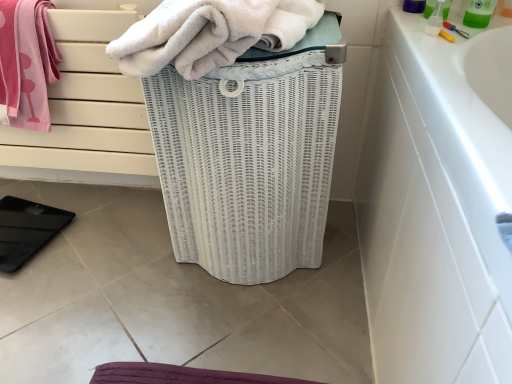
What is the approximate width of pink cotton towel at upper left, which is the 1th towel in left-to-right order?

It is 6.63 inches.

What do you see at coordinates (210, 34) in the screenshot? I see `white fluffy towel at center, which appears as the 1th towel when viewed from the right` at bounding box center [210, 34].

What do you see at coordinates (250, 157) in the screenshot?
I see `white wicker basket at center` at bounding box center [250, 157].

This screenshot has height=384, width=512. I want to click on white wicker basket at center, so click(x=250, y=157).

At what (x,y) coordinates should I click in order to perform the action: click on pink cotton towel at upper left, which is the 2th towel in right-to-left order. Please return your answer as a coordinate pair (x, y). This screenshot has height=384, width=512. Looking at the image, I should click on (26, 64).

From a real-world perspective, which is physically above, white fluffy towel at center, which appears as the 1th towel when viewed from the right, or white wicker basket at center?

From a 3D spatial view, white fluffy towel at center, which appears as the 1th towel when viewed from the right, is above.

Between white fluffy towel at center, which appears as the 1th towel when viewed from the right, and white wicker basket at center, which one is positioned in front?

Positioned in front is white fluffy towel at center, which appears as the 1th towel when viewed from the right.

Is white fluffy towel at center, arranged as the second towel when viewed from the left, taller or shorter than white wicker basket at center?

Clearly, white fluffy towel at center, arranged as the second towel when viewed from the left, is shorter compared to white wicker basket at center.

Image resolution: width=512 pixels, height=384 pixels. In order to click on the 2nd towel directly above the white wicker basket at center (from a real-world perspective) in this screenshot , I will do `click(210, 34)`.

From the image's perspective, is white wicker basket at center above or below pink cotton towel at upper left, which is the 2th towel in right-to-left order?

white wicker basket at center is situated lower than pink cotton towel at upper left, which is the 2th towel in right-to-left order, in the image.

Considering the sizes of objects white wicker basket at center and pink cotton towel at upper left, which is the 1th towel in left-to-right order, in the image provided, who is bigger, white wicker basket at center or pink cotton towel at upper left, which is the 1th towel in left-to-right order,?

Bigger between the two is white wicker basket at center.

Can you tell me how much white wicker basket at center and pink cotton towel at upper left, which is the 1th towel in left-to-right order, differ in facing direction?

white wicker basket at center and pink cotton towel at upper left, which is the 1th towel in left-to-right order, are facing 0.486 degrees away from each other.

Is green plastic bottle at upper right oriented towards white fluffy towel at center, which appears as the 1th towel when viewed from the right?

No, green plastic bottle at upper right is not facing towards white fluffy towel at center, which appears as the 1th towel when viewed from the right.

From the image's perspective, which is above, green plastic bottle at upper right or white fluffy towel at center, which appears as the 1th towel when viewed from the right?

From the image's view, green plastic bottle at upper right is above.

Is green plastic bottle at upper right not close to white fluffy towel at center, which appears as the 1th towel when viewed from the right?

No.

From the image's perspective, which one is positioned lower, white wicker basket at center or green plastic bottle at upper right?

white wicker basket at center, from the image's perspective.

Find the location of `cleaning product on the right side of white wicker basket at center`. cleaning product on the right side of white wicker basket at center is located at coordinates (479, 13).

How many degrees apart are the facing directions of white wicker basket at center and green plastic bottle at upper right?

The facing directions of white wicker basket at center and green plastic bottle at upper right are 26.3 degrees apart.

In the scene shown: Is white wicker basket at center positioned with its back to green plastic bottle at upper right?

No, white wicker basket at center is not facing away from green plastic bottle at upper right.

Looking at their sizes, would you say pink cotton towel at upper left, which is the 1th towel in left-to-right order, is wider or thinner than white wicker basket at center?

In the image, pink cotton towel at upper left, which is the 1th towel in left-to-right order, appears to be more narrow than white wicker basket at center.

From a real-world perspective, is pink cotton towel at upper left, which is the 1th towel in left-to-right order, physically located above or below white wicker basket at center?

From a real-world perspective, pink cotton towel at upper left, which is the 1th towel in left-to-right order, is physically above white wicker basket at center.

Which of these two, pink cotton towel at upper left, which is the 1th towel in left-to-right order, or white wicker basket at center, is bigger?

Bigger between the two is white wicker basket at center.

Can you confirm if pink cotton towel at upper left, which is the 2th towel in right-to-left order, is shorter than white wicker basket at center?

Indeed, pink cotton towel at upper left, which is the 2th towel in right-to-left order, has a lesser height compared to white wicker basket at center.

Considering the relative positions of green plastic bottle at upper right and pink cotton towel at upper left, which is the 2th towel in right-to-left order, in the image provided, is green plastic bottle at upper right to the left or to the right of pink cotton towel at upper left, which is the 2th towel in right-to-left order,?

Clearly, green plastic bottle at upper right is on the right of pink cotton towel at upper left, which is the 2th towel in right-to-left order, in the image.

Is green plastic bottle at upper right thinner than pink cotton towel at upper left, which is the 2th towel in right-to-left order?

Yes, green plastic bottle at upper right is thinner than pink cotton towel at upper left, which is the 2th towel in right-to-left order.

Is pink cotton towel at upper left, which is the 2th towel in right-to-left order, at the back of green plastic bottle at upper right?

That's not correct — green plastic bottle at upper right is not looking away from pink cotton towel at upper left, which is the 2th towel in right-to-left order.

From the image's perspective, does green plastic bottle at upper right appear lower than pink cotton towel at upper left, which is the 2th towel in right-to-left order?

No, from the image's perspective, green plastic bottle at upper right is not beneath pink cotton towel at upper left, which is the 2th towel in right-to-left order.

Consider the image. Between white fluffy towel at center, which appears as the 1th towel when viewed from the right, and green plastic bottle at upper right, which one has smaller width?

green plastic bottle at upper right is thinner.

Is point (285, 8) closer or farther from the camera than point (468, 14)?

Point (285, 8) is closer to the camera than point (468, 14).

In the scene shown: From the image's perspective, is white fluffy towel at center, which appears as the 1th towel when viewed from the right, located above green plastic bottle at upper right?

Incorrect, from the image's perspective, white fluffy towel at center, which appears as the 1th towel when viewed from the right, is lower than green plastic bottle at upper right.

Is white fluffy towel at center, arranged as the second towel when viewed from the left, facing towards green plastic bottle at upper right?

No, white fluffy towel at center, arranged as the second towel when viewed from the left, is not aimed at green plastic bottle at upper right.

Identify the location of towel in front of the white wicker basket at center. (210, 34).

Identify the location of basket container below the pink cotton towel at upper left, which is the 2th towel in right-to-left order (from the image's perspective). (250, 157).

Based on the photo, which object lies nearer to the anchor point white wicker basket at center, white fluffy towel at center, arranged as the second towel when viewed from the left, or pink cotton towel at upper left, which is the 1th towel in left-to-right order?

white fluffy towel at center, arranged as the second towel when viewed from the left.

When comparing their distances from white wicker basket at center, does green plastic bottle at upper right or white fluffy towel at center, which appears as the 1th towel when viewed from the right, seem closer?

white fluffy towel at center, which appears as the 1th towel when viewed from the right.

Looking at this image, from the image, which object appears to be farther from white fluffy towel at center, arranged as the second towel when viewed from the left, green plastic bottle at upper right or white wicker basket at center?

green plastic bottle at upper right lies further to white fluffy towel at center, arranged as the second towel when viewed from the left, than the other object.

Based on their spatial positions, is white wicker basket at center or green plastic bottle at upper right closer to pink cotton towel at upper left, which is the 2th towel in right-to-left order?

white wicker basket at center is positioned closer to the anchor pink cotton towel at upper left, which is the 2th towel in right-to-left order.

Which object lies further to the anchor point pink cotton towel at upper left, which is the 2th towel in right-to-left order, green plastic bottle at upper right or white fluffy towel at center, arranged as the second towel when viewed from the left?

green plastic bottle at upper right is positioned further to the anchor pink cotton towel at upper left, which is the 2th towel in right-to-left order.

Based on their spatial positions, is white wicker basket at center or pink cotton towel at upper left, which is the 2th towel in right-to-left order, further from green plastic bottle at upper right?

pink cotton towel at upper left, which is the 2th towel in right-to-left order, lies further to green plastic bottle at upper right than the other object.

From the image, which object appears to be nearer to white fluffy towel at center, which appears as the 1th towel when viewed from the right, pink cotton towel at upper left, which is the 2th towel in right-to-left order, or white wicker basket at center?

The object closer to white fluffy towel at center, which appears as the 1th towel when viewed from the right, is white wicker basket at center.

Which object lies further to the anchor point white fluffy towel at center, arranged as the second towel when viewed from the left, white wicker basket at center or green plastic bottle at upper right?

green plastic bottle at upper right.

Locate an element on the screen. The width and height of the screenshot is (512, 384). basket container situated between white fluffy towel at center, which appears as the 1th towel when viewed from the right, and green plastic bottle at upper right from left to right is located at coordinates (250, 157).

Locate an element on the screen. The image size is (512, 384). basket container between pink cotton towel at upper left, which is the 2th towel in right-to-left order, and green plastic bottle at upper right is located at coordinates (250, 157).

What are the coordinates of `towel located between pink cotton towel at upper left, which is the 2th towel in right-to-left order, and white wicker basket at center in the left-right direction` in the screenshot? It's located at (210, 34).

What are the coordinates of `towel located between pink cotton towel at upper left, which is the 2th towel in right-to-left order, and green plastic bottle at upper right in the left-right direction` in the screenshot? It's located at (210, 34).